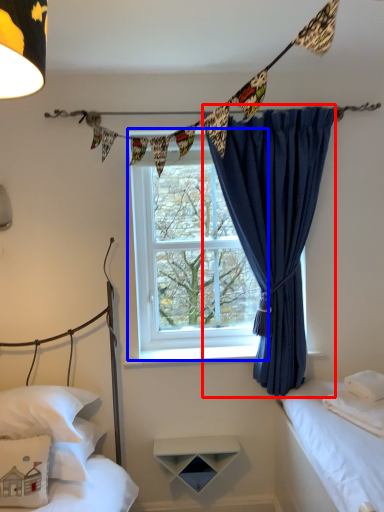
Question: Which point is closer to the camera, curtain (highlighted by a red box) or window (highlighted by a blue box)?

Choices:
 (A) curtain
 (B) window

Answer: (A)